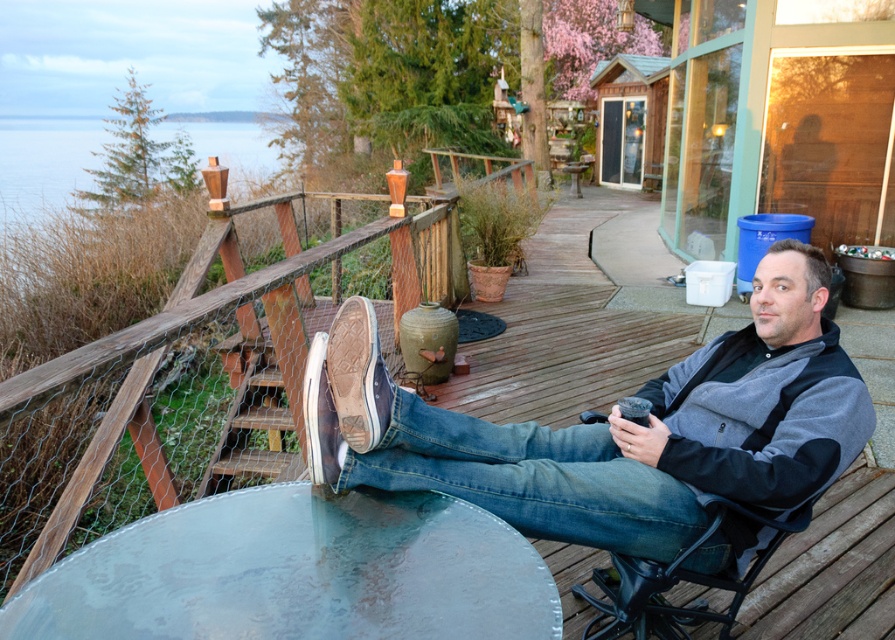
Question: Does denim jeans at center have a smaller size compared to black metal chair at right?

Choices:
 (A) no
 (B) yes

Answer: (A)

Question: In this image, where is denim jeans at center located relative to clear glass table at lower center?

Choices:
 (A) left
 (B) right

Answer: (B)

Question: Among these objects, which one is nearest to the camera?

Choices:
 (A) black metal chair at right
 (B) clear glass table at lower center

Answer: (B)

Question: Which point is closer to the camera?

Choices:
 (A) (652, 588)
 (B) (203, 417)
 (C) (277, 573)
 (D) (358, 346)

Answer: (C)

Question: Is wooden rail at upper left wider than black metal chair at right?

Choices:
 (A) yes
 (B) no

Answer: (B)

Question: Which object is positioned farthest from the wooden rail at upper left?

Choices:
 (A) clear glass table at lower center
 (B) denim jeans at center

Answer: (B)